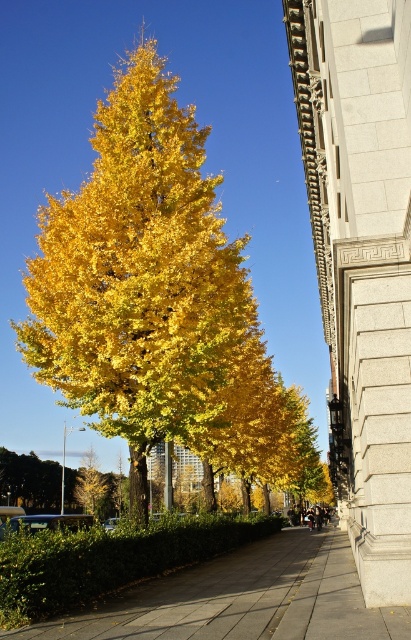
You are a city planner assessing the space between the golden leafy tree at center and the smooth concrete pavement at center. Based on their heights, which one would block the view of the sky more when standing in front of them?

The golden leafy tree at center has a greater height compared to the smooth concrete pavement at center, so it would block the view of the sky more when standing in front of them.

You are standing in the middle of the sidewalk and want to take a photo of the golden leafy tree at center. Considering the distance, will you need to zoom in your camera to capture the entire tree in the frame?

The golden leafy tree at center is 14.61 meters away from the camera. At this distance, you may need to zoom in to ensure the entire tree fits within the camera frame.